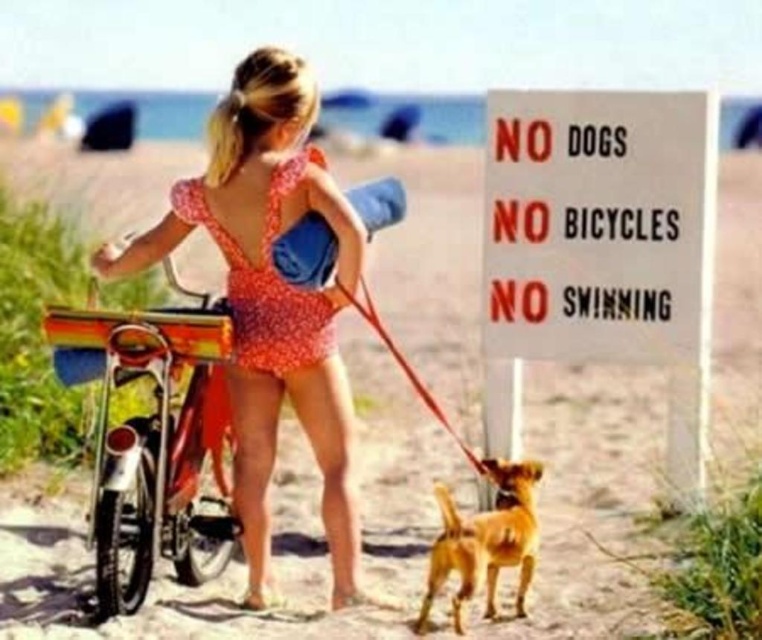
You are a park ranger who needs to ensure compliance with the beach rules. You see the shiny chrome bicycle at center and the golden fur dog at lower center. According to the sign, are both violating the rules?

Yes, both are violating the rules because the sign states NO DOGS and NO BICYCLES. The golden fur dog at lower center is present, and the shiny chrome bicycle at center is also present, so both are against the rules.

You are a park ranger who just arrived at the beach and noticed the white paper sign at center and the golden fur dog at lower center. According to the sign, what violation is currently happening here?

The golden fur dog at lower center is violating the rule because the white paper sign at center explicitly states that no dogs are allowed.

You are standing at the point labeled as point (508, 477) and want to walk to the point labeled as point (663, 330). According to the scene, will you have to walk forward or backward to reach your destination?

Since point (663, 330) is behind point (508, 477), you would need to walk backward to reach it from your current position at point (508, 477).